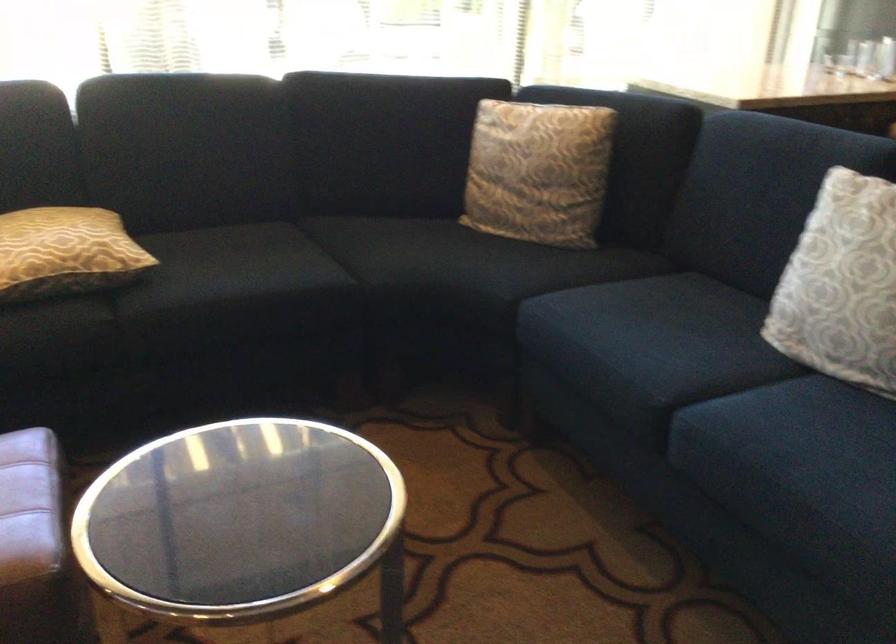
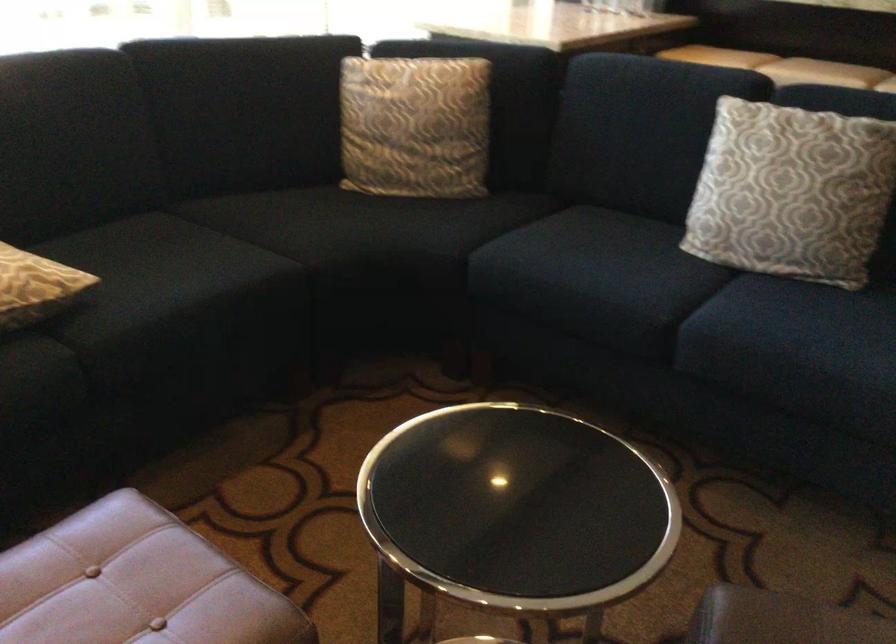
Where in the second image is the point corresponding to point (622, 337) from the first image?

(590, 274)